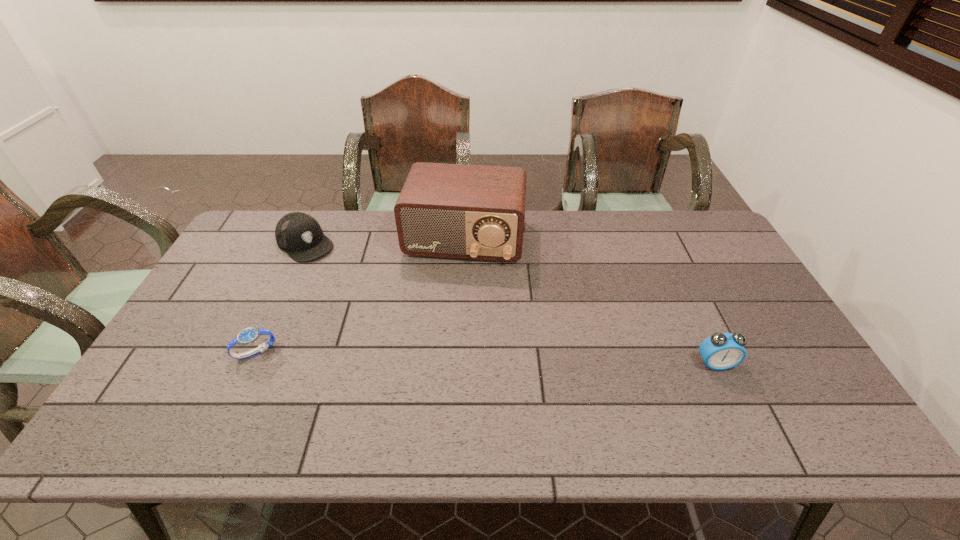
This screenshot has height=540, width=960. Find the location of `vacant area that lies between the radio receiver and the watch`. vacant area that lies between the radio receiver and the watch is located at coordinates (361, 296).

This screenshot has height=540, width=960. I want to click on empty space between the rightmost object and the cap, so tap(511, 303).

Where is `free space between the rightmost object and the cap`? free space between the rightmost object and the cap is located at coordinates (511, 303).

Identify the location of vacant area that lies between the cap and the rightmost object. (511, 303).

Where is `object that ranks as the third closest to the cap`? object that ranks as the third closest to the cap is located at coordinates (721, 351).

Identify which object is located as the third nearest to the third object from left to right. Please provide its 2D coordinates. Your answer should be formatted as a tuple, i.e. [(x, y)], where the tuple contains the x and y coordinates of a point satisfying the conditions above.

[(721, 351)]